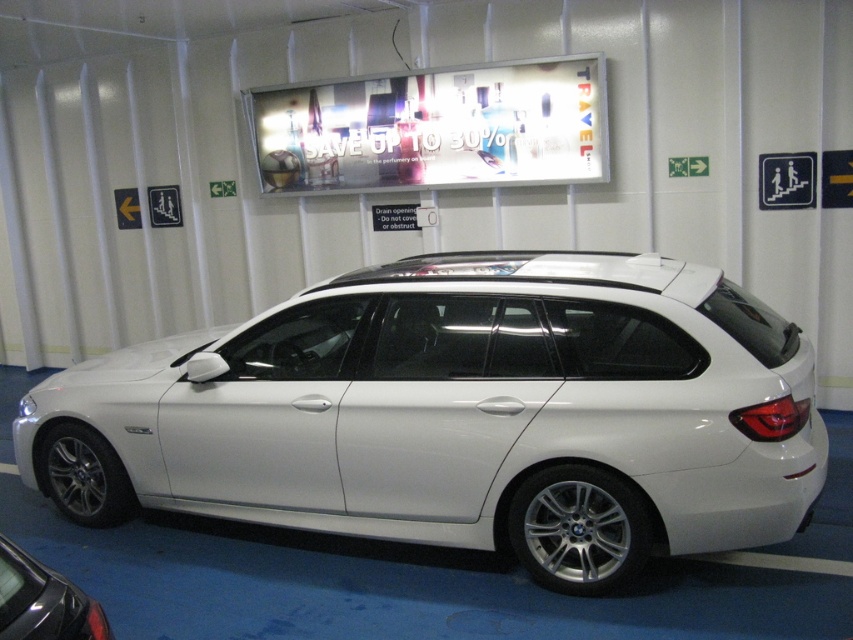
You are a parking attendant trying to direct a driver to an available parking spot. You see the white metallic car at center and the white metallic car at lower left. Which car is positioned further to the right side of the parking area?

The white metallic car at center is positioned further to the right side of the parking area because it is to the right of the white metallic car at lower left.

You are a parking attendant trying to fit a new vehicle into the space between the white metallic car at center and the white metallic car at lower left. The new vehicle is 1.8 meters wide. Can you determine if there is enough space between them to accommodate the new vehicle?

The white metallic car at center is wider than the white metallic car at lower left. However, without knowing the exact distance between them, it is impossible to determine if the 1.8 meter wide vehicle will fit. Additional information about the spacing between the cars is required to make an accurate assessment.